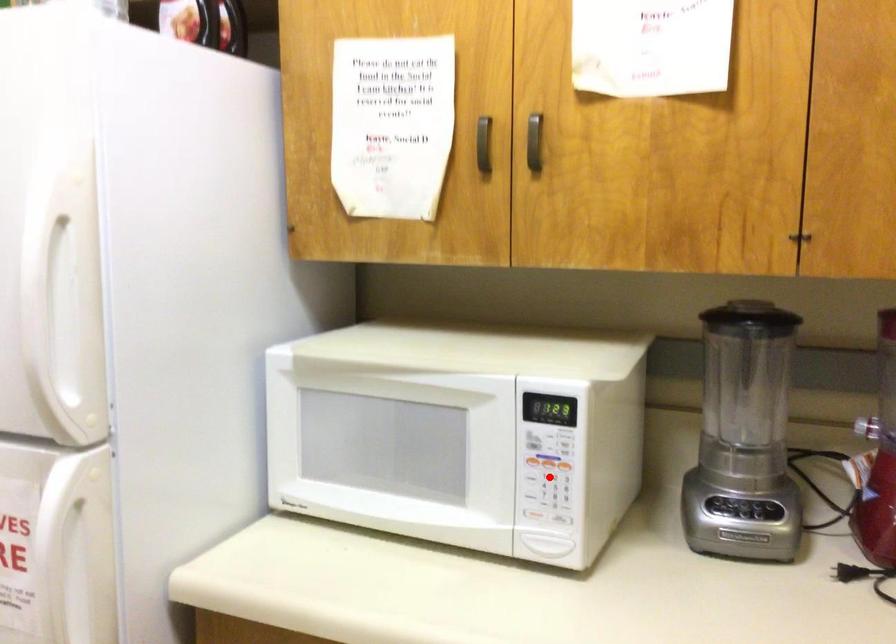
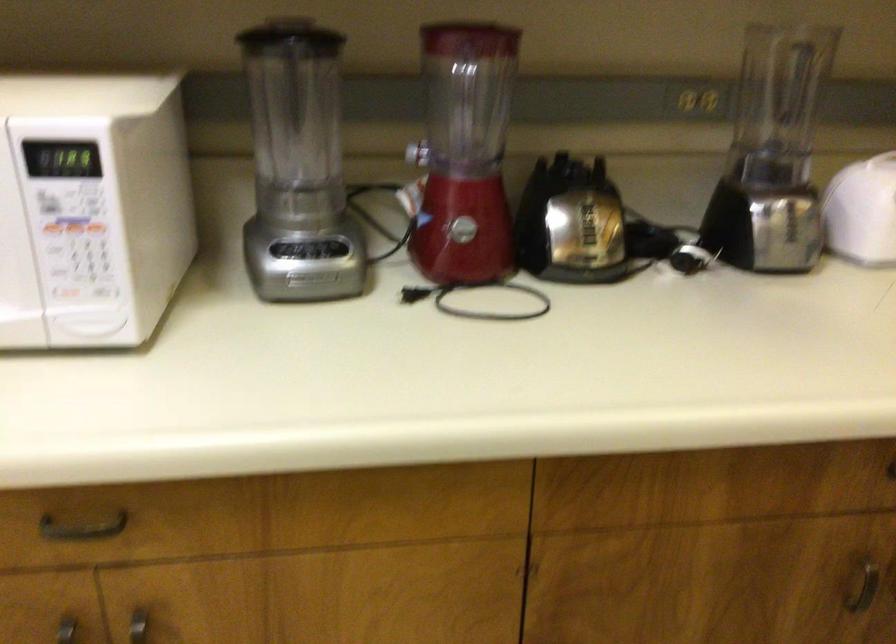
Question: A red point is marked in image1. In image2, is the corresponding 3D point closer to the camera or farther? Reply with the corresponding letter.

Choices:
 (A) The corresponding 3D point is closer.
 (B) The corresponding 3D point is farther.

Answer: (A)